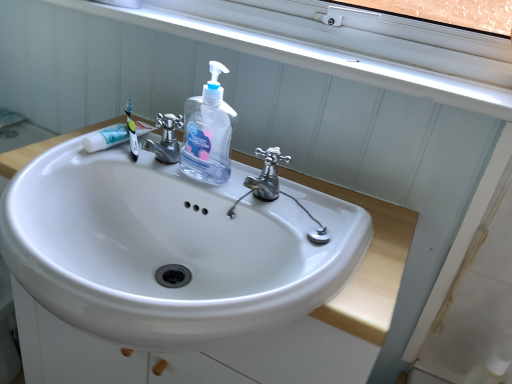
The height and width of the screenshot is (384, 512). In order to click on empty space that is to the right of polished chrome tap at center, placed as the second tap when sorted from left to right in this screenshot , I will do `click(367, 232)`.